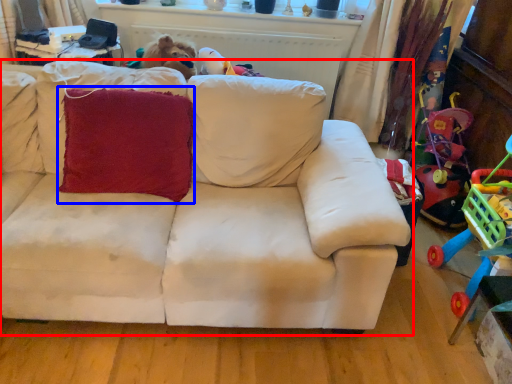
Question: Which object appears farthest to the camera in this image, studio couch (highlighted by a red box) or throw pillow (highlighted by a blue box)?

Choices:
 (A) studio couch
 (B) throw pillow

Answer: (B)